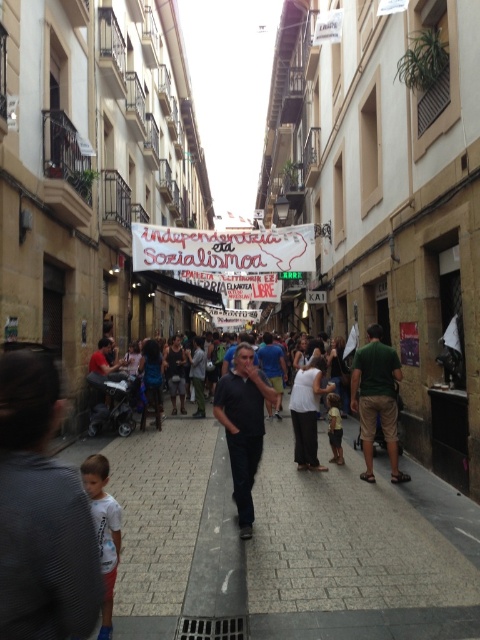
Does green fabric shirt at right lie behind white cotton shirt at lower left?

Yes.

Does green fabric shirt at right appear over white cotton shirt at lower left?

Indeed, green fabric shirt at right is positioned over white cotton shirt at lower left.

Which is behind, point (355, 394) or point (119, 509)?

The point (355, 394) is more distant.

This screenshot has width=480, height=640. What are the coordinates of `green fabric shirt at right` in the screenshot? It's located at [x=376, y=400].

How far apart are green fabric shirt at right and white cotton shirt at center?

A distance of 83.60 centimeters exists between green fabric shirt at right and white cotton shirt at center.

Is point (362, 442) positioned after point (313, 449)?

That is False.

Identify the location of green fabric shirt at right. The width and height of the screenshot is (480, 640). (376, 400).

How much distance is there between white paper banner at center and green fabric shirt at right?

white paper banner at center and green fabric shirt at right are 6.25 meters apart.

Who is taller, white paper banner at center or green fabric shirt at right?

With more height is green fabric shirt at right.

Identify the location of white paper banner at center. Image resolution: width=480 pixels, height=640 pixels. (223, 250).